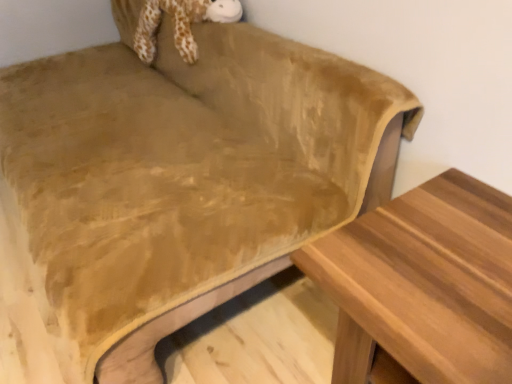
What are the coordinates of `free location above light brown wood table at lower right (from a real-world perspective)` in the screenshot? It's located at pos(445,262).